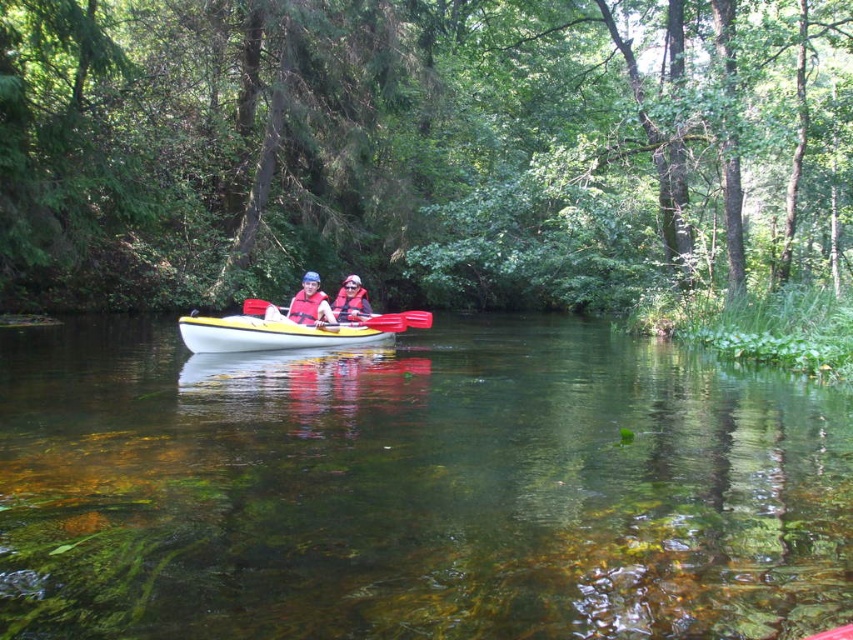
Question: From the image, what is the correct spatial relationship of yellow matte kayak at center in relation to matte red life vest at center?

Choices:
 (A) right
 (B) left

Answer: (B)

Question: Is matte red life vest at center thinner than yellow plastic paddle at center?

Choices:
 (A) no
 (B) yes

Answer: (B)

Question: Which object appears farthest from the camera in this image?

Choices:
 (A) matte red life vest at center
 (B) clear water at center

Answer: (A)

Question: Among these points, which one is nearest to the camera?

Choices:
 (A) (386, 321)
 (B) (190, 324)
 (C) (289, 305)
 (D) (3, 348)

Answer: (B)

Question: Can you confirm if yellow matte kayak at center is positioned to the left of matte red life vest at center?

Choices:
 (A) no
 (B) yes

Answer: (B)

Question: Based on their relative distances, which object is nearer to the clear water at center?

Choices:
 (A) matte red life vest at center
 (B) yellow matte kayak at center
 (C) matte blue life vest at center

Answer: (B)